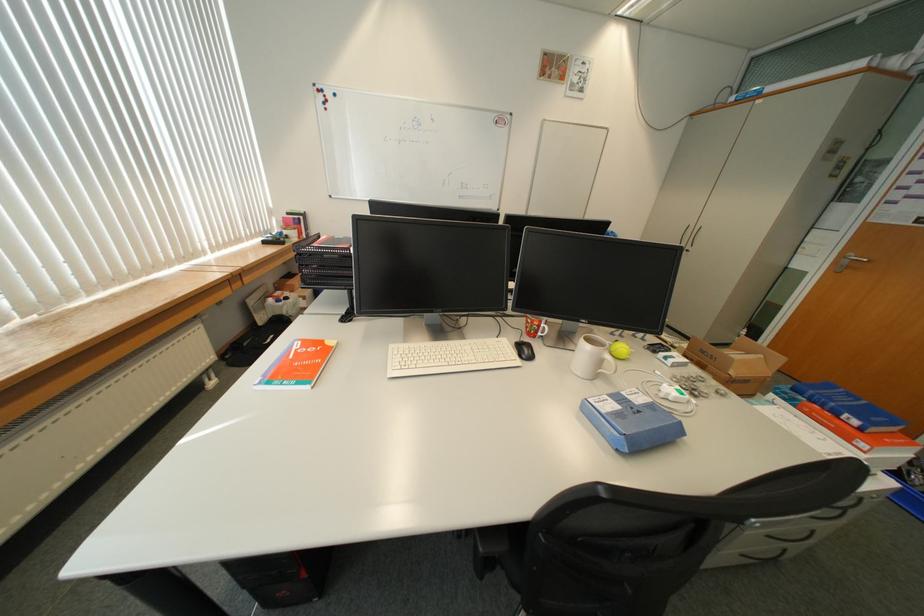
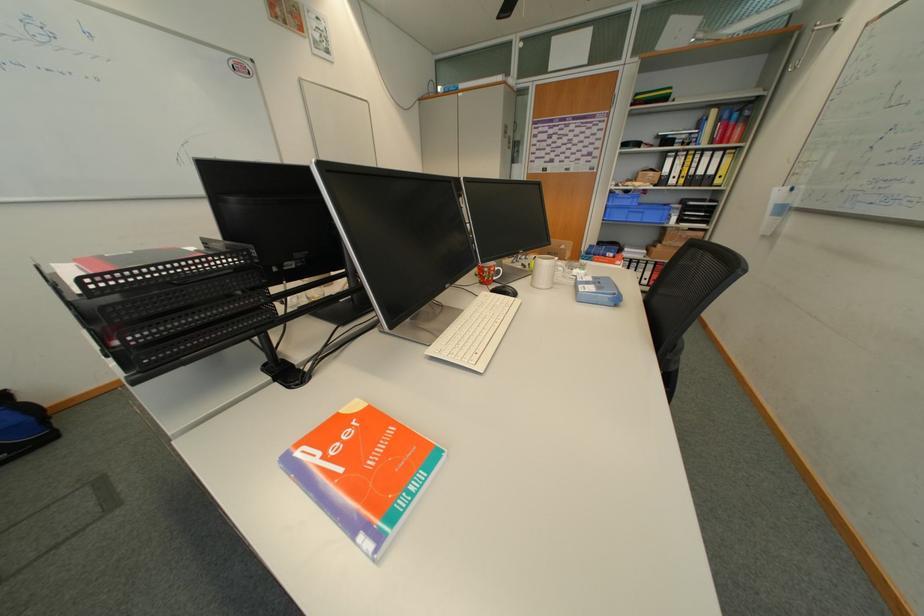
Question: The camera is either moving clockwise (left) or counter-clockwise (right) around the object. The first image is from the beginning of the video and the second image is from the end. Is the camera moving left or right when shooting the video?

Choices:
 (A) Left
 (B) Right

Answer: (A)